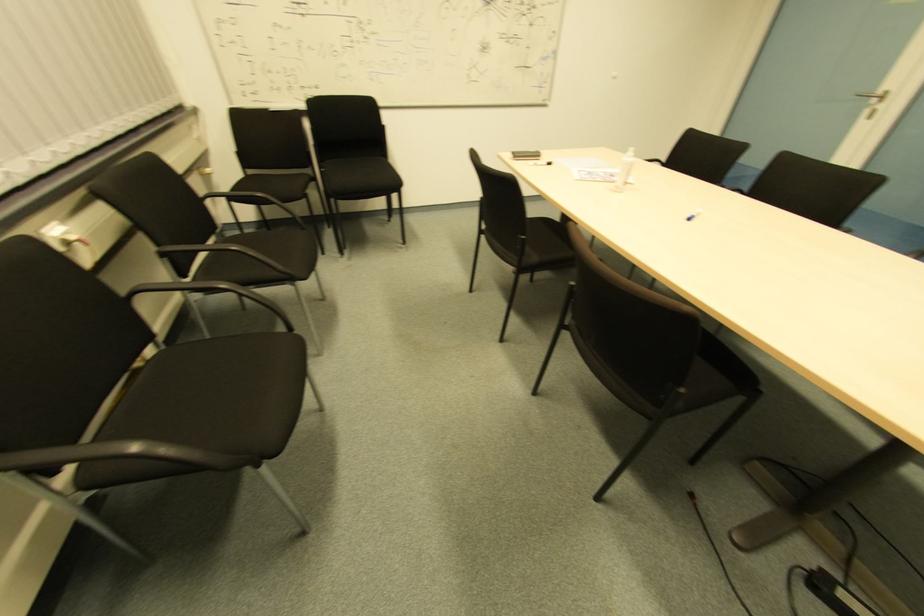
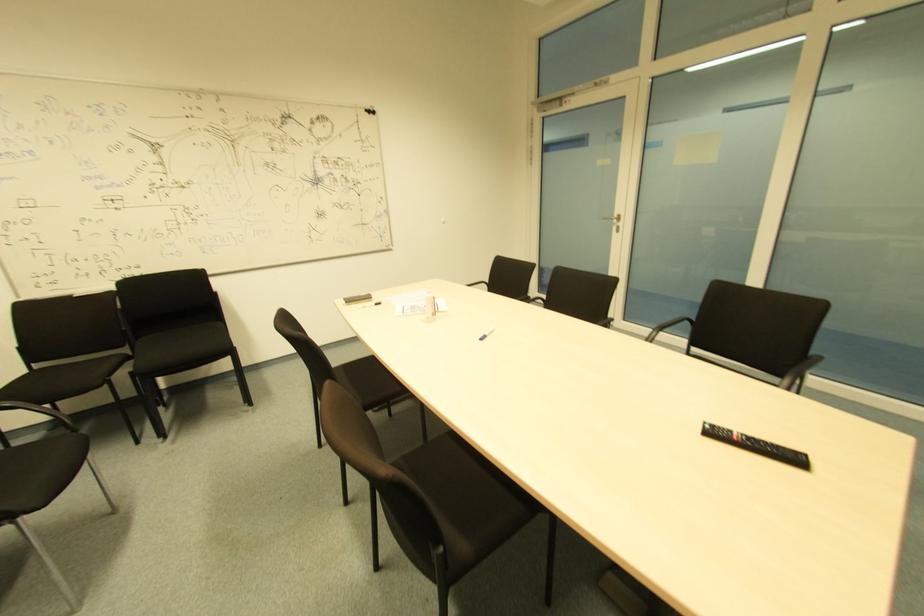
Question: The images are taken continuously from a first-person perspective. In which direction are you moving?

Choices:
 (A) Left
 (B) Right
 (C) Forward
 (D) Backward

Answer: (B)